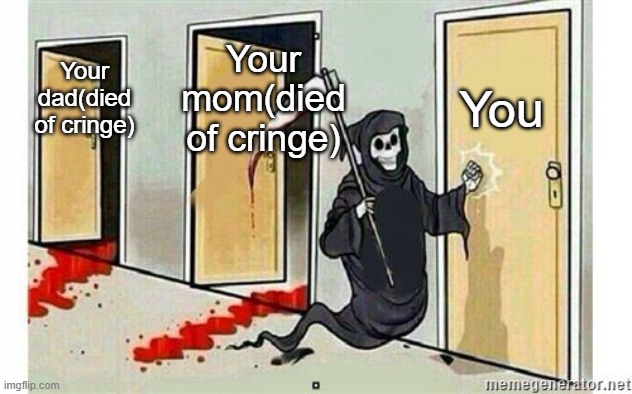
Identify the location of wall. (354, 60).